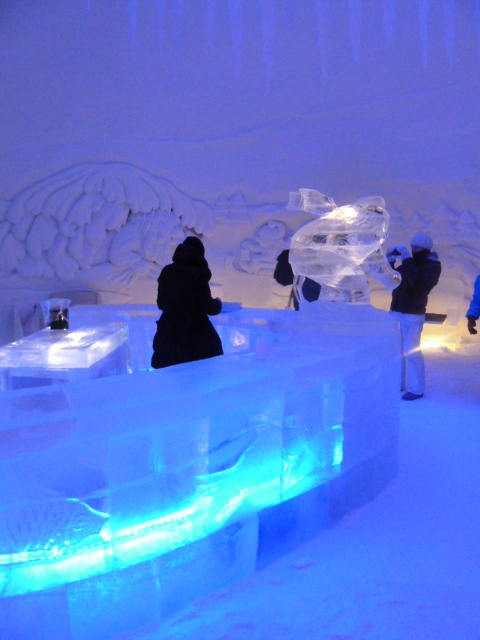
You are a GUI agent. You are given a task and a screenshot of the screen. Output one action in this format:
    pyautogui.click(x=<x>, y=<y>)
    Task: Click on the counter
    The height and width of the screenshot is (640, 480).
    Given the screenshot: What is the action you would take?
    coord(75,344)